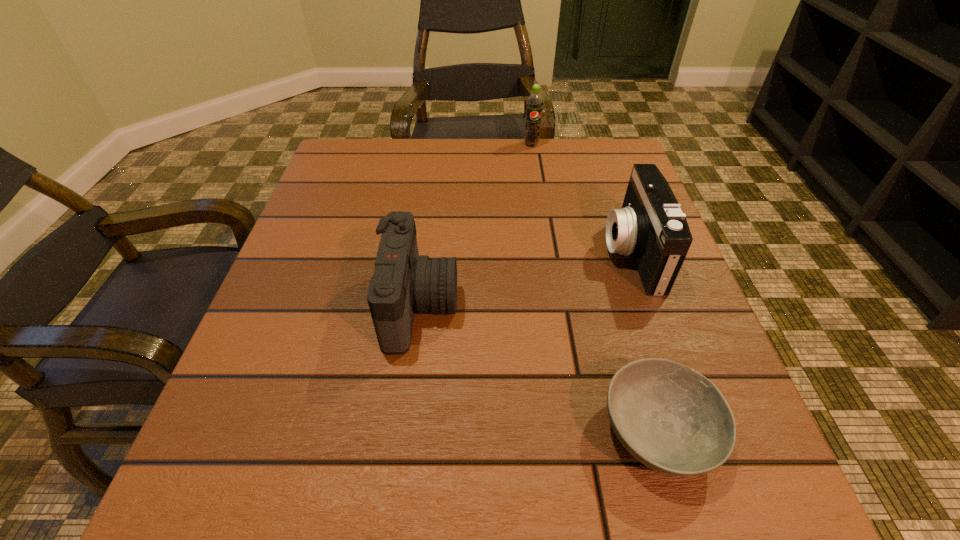
This screenshot has height=540, width=960. I want to click on vacant space at the right edge of the desktop, so click(600, 246).

Where is `vacant space at the far left corner`? This screenshot has height=540, width=960. vacant space at the far left corner is located at coordinates 371,144.

Find the location of `vacant area at the far right corner`. vacant area at the far right corner is located at coordinates (588, 166).

Where is `empty location between the leftmost object and the bowl`? This screenshot has width=960, height=540. empty location between the leftmost object and the bowl is located at coordinates (539, 369).

You are a GUI agent. You are given a task and a screenshot of the screen. Output one action in this format:
    pyautogui.click(x=<x>, y=<y>)
    Task: Click on the vacant space that's between the camcorder and the camera
    This screenshot has height=540, width=960.
    Given the screenshot: What is the action you would take?
    pyautogui.click(x=526, y=279)

The image size is (960, 540). I want to click on vacant region between the camcorder and the camera, so click(x=526, y=279).

The height and width of the screenshot is (540, 960). I want to click on empty space between the camera and the camcorder, so click(526, 279).

Locate an element on the screen. The image size is (960, 540). unoccupied position between the camera and the camcorder is located at coordinates (526, 279).

I want to click on free space between the leftmost object and the soda, so click(x=476, y=225).

I want to click on free space between the leftmost object and the bowl, so click(539, 369).